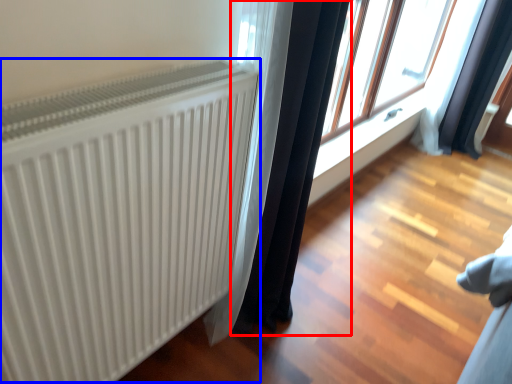
Question: Which object is closer to the camera taking this photo, curtain (highlighted by a red box) or radiator (highlighted by a blue box)?

Choices:
 (A) curtain
 (B) radiator

Answer: (B)